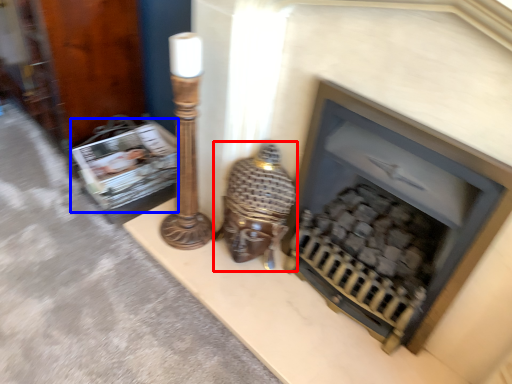
Question: Which object is closer to the camera taking this photo, table lamp (highlighted by a red box) or magazine (highlighted by a blue box)?

Choices:
 (A) table lamp
 (B) magazine

Answer: (A)